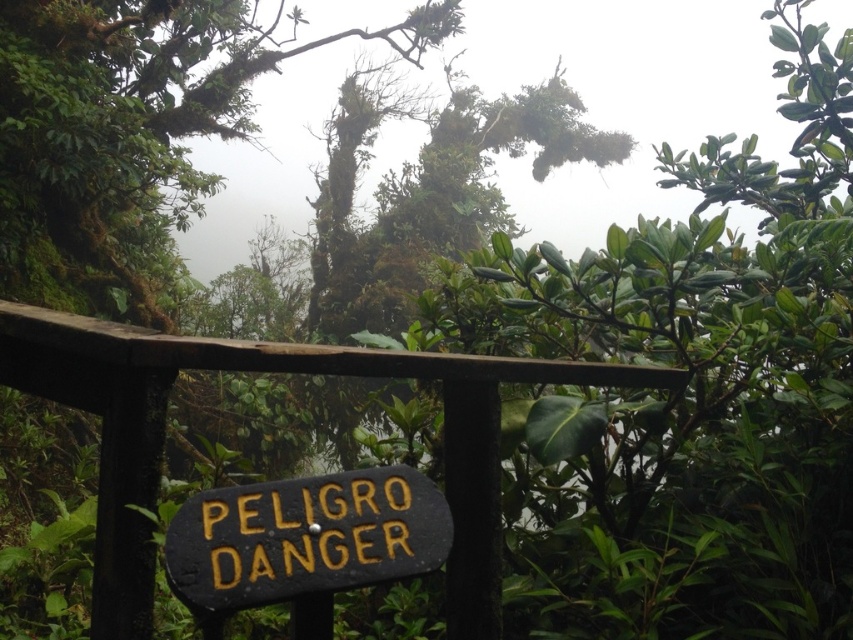
Which of these two, brown wood rail at center or black painted wood sign at center, stands taller?

With more height is brown wood rail at center.

Is brown wood rail at center shorter than black painted wood sign at center?

In fact, brown wood rail at center may be taller than black painted wood sign at center.

Is point (131, 328) more distant than point (416, 536)?

Yes, it is behind point (416, 536).

You are a GUI agent. You are given a task and a screenshot of the screen. Output one action in this format:
    pyautogui.click(x=<x>, y=<y>)
    Task: Click on the brown wood rail at center
    The height and width of the screenshot is (640, 853).
    Given the screenshot: What is the action you would take?
    pyautogui.click(x=268, y=371)